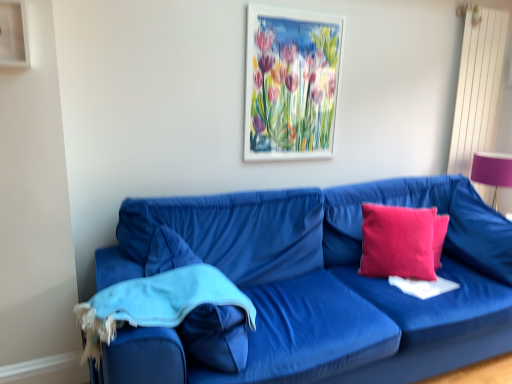
Where is `free point above white matte picture frame at upper center (from a real-world perspective)`? This screenshot has height=384, width=512. free point above white matte picture frame at upper center (from a real-world perspective) is located at coordinates pyautogui.click(x=292, y=7).